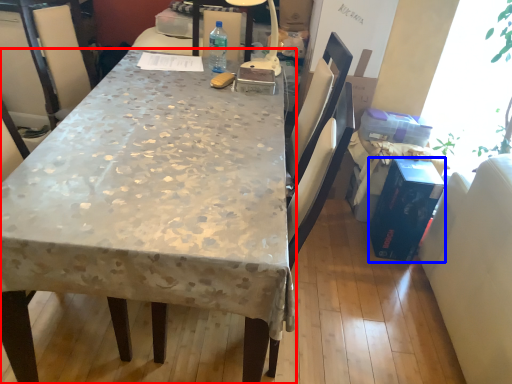
Question: Among these objects, which one is nearest to the camera, desk (highlighted by a red box) or box (highlighted by a blue box)?

Choices:
 (A) desk
 (B) box

Answer: (A)